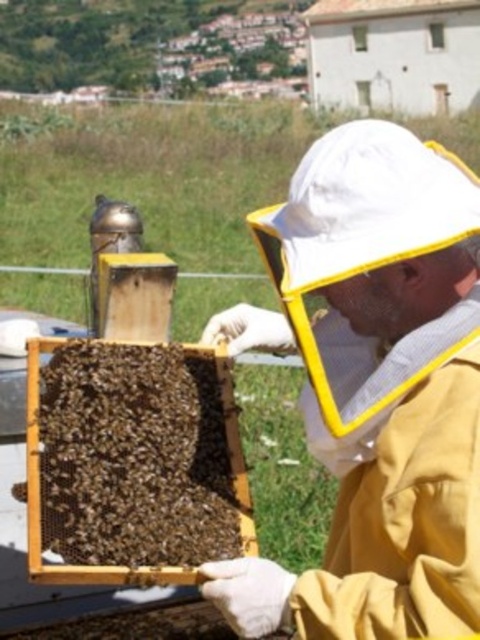
Question: Is yellow fabric beekeeper suit at center smaller than brown wooden beehive at center?

Choices:
 (A) yes
 (B) no

Answer: (B)

Question: Which point is farther to the camera?

Choices:
 (A) (348, 156)
 (B) (147, 522)

Answer: (B)

Question: Which object is closer to the camera taking this photo?

Choices:
 (A) brown wooden beehive at center
 (B) yellow fabric beekeeper suit at center

Answer: (B)

Question: Which of the following is the closest to the observer?

Choices:
 (A) yellow fabric beekeeper suit at center
 (B) brown wooden beehive at center

Answer: (A)

Question: Can you confirm if yellow fabric beekeeper suit at center is positioned above brown wooden beehive at center?

Choices:
 (A) no
 (B) yes

Answer: (B)

Question: From the image, what is the correct spatial relationship of yellow fabric beekeeper suit at center in relation to brown wooden beehive at center?

Choices:
 (A) below
 (B) above

Answer: (B)